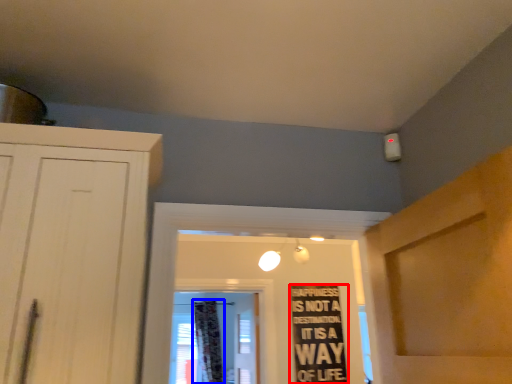
Question: Which of the following is the farthest to the observer, bulletin board (highlighted by a red box) or curtain (highlighted by a blue box)?

Choices:
 (A) bulletin board
 (B) curtain

Answer: (B)